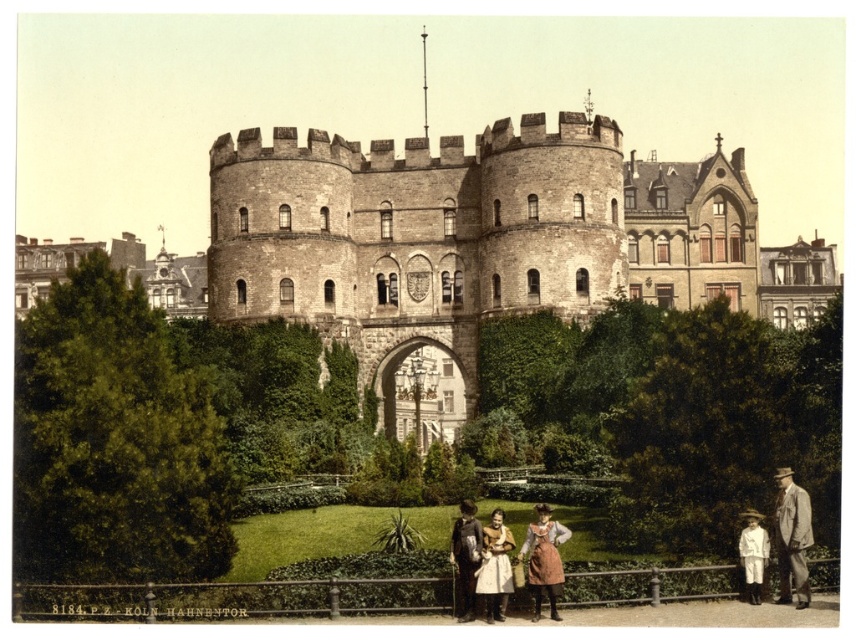
Question: Which point is farther from the camera taking this photo?

Choices:
 (A) (782, 477)
 (B) (765, 538)
 (C) (492, 612)

Answer: (A)

Question: Does light brown suit at lower right come behind white cotton dress at center?

Choices:
 (A) yes
 (B) no

Answer: (B)

Question: Which of the following is the closest to the observer?

Choices:
 (A) white cotton dress at center
 (B) matte brown dress at center
 (C) light brown suit at lower right

Answer: (B)

Question: Does light brown suit at lower right lie in front of white cotton dress at center?

Choices:
 (A) yes
 (B) no

Answer: (A)

Question: Can you confirm if light brown suit at lower right is thinner than white cotton shirt at lower right?

Choices:
 (A) no
 (B) yes

Answer: (A)

Question: Estimate the real-world distances between objects in this image. Which object is farther from the brown leather jacket at center?

Choices:
 (A) white cotton dress at center
 (B) light brown suit at lower right
 (C) matte brown dress at center

Answer: (B)